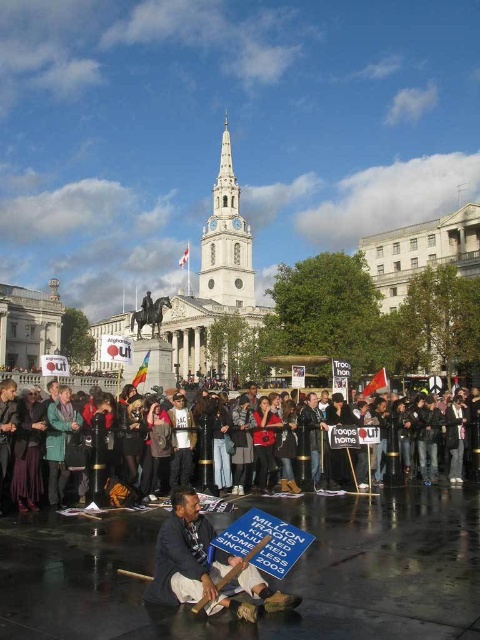
What is the spatial relationship between the blue fabric sign at lower center and the dark brown leather jacket at center in the protest scene?

The blue fabric sign at lower center is located below the dark brown leather jacket at center.

You are a photographer standing at the camera position. You want to capture a closeup shot of the blue fabric sign at lower center. Given that your camera can focus on objects within 10 meters, will you be able to take the photo without moving closer?

The blue fabric sign at lower center is 39.36 meters away from the camera. Since the camera can only focus on objects within 10 meters, you will need to move closer to take the closeup shot.

Based on the photo, you are a photographer at the protest scene. You want to take a photo of the dark brown leather jacket at center without the blue fabric sign at lower center blocking it. How should you adjust your position?

Move your position so that the dark brown leather jacket at center is no longer behind the blue fabric sign at lower center. Since the blue fabric sign at lower center is in front of the dark brown leather jacket at center, you can move to the side or angle your camera to avoid the sign blocking the jacket.